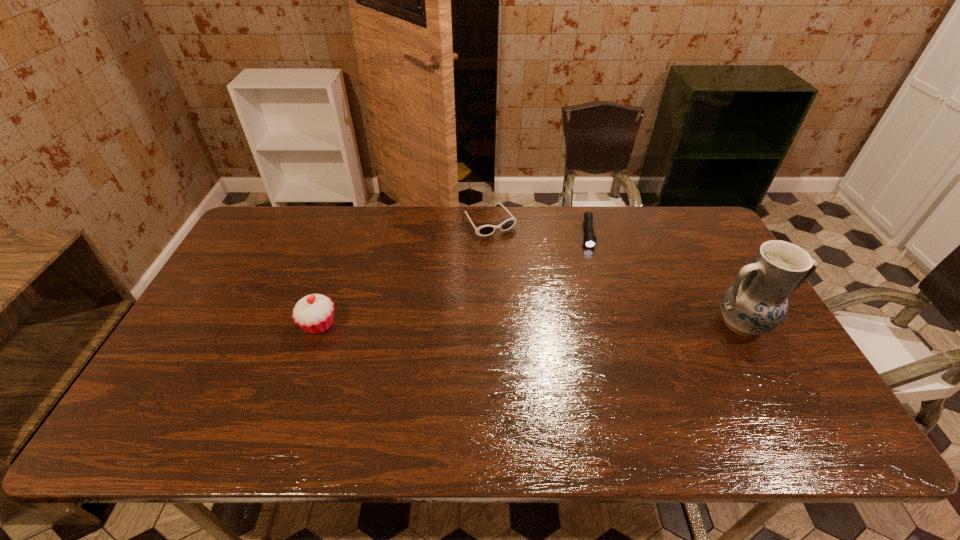
Locate an element on the screen. free spot at the near edge of the desktop is located at coordinates pyautogui.click(x=437, y=390).

In the image, there is a desktop. Identify the location of free space at the left edge. The height and width of the screenshot is (540, 960). (232, 296).

What are the coordinates of `vacant space at the right edge of the desktop` in the screenshot? It's located at (778, 348).

Identify the location of free space at the far left corner of the desktop. The width and height of the screenshot is (960, 540). (298, 228).

You are a GUI agent. You are given a task and a screenshot of the screen. Output one action in this format:
    pyautogui.click(x=<x>, y=<y>)
    Task: Click on the free space at the near left corner of the desktop
    The width and height of the screenshot is (960, 540).
    Given the screenshot: What is the action you would take?
    pyautogui.click(x=204, y=385)

The height and width of the screenshot is (540, 960). I want to click on vacant region at the far right corner of the desktop, so click(x=694, y=210).

Find the location of `free space at the near right corner of the desktop`. free space at the near right corner of the desktop is located at coordinates (750, 388).

The image size is (960, 540). Identify the location of vacant point located between the flashlight and the second shortest object. (539, 228).

Where is `vacant space in between the second object from left to right and the leftmost object`? The width and height of the screenshot is (960, 540). vacant space in between the second object from left to right and the leftmost object is located at coordinates (404, 273).

Where is `free space between the second shortest object and the second tallest object`? Image resolution: width=960 pixels, height=540 pixels. free space between the second shortest object and the second tallest object is located at coordinates tap(404, 273).